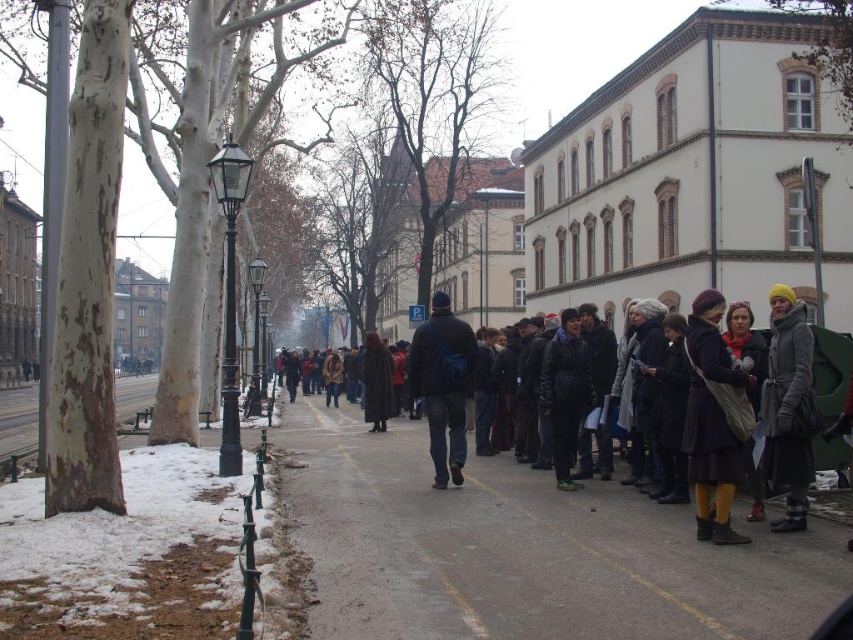
You are a photographer trying to capture a photo of the dark gray coat at center and the yellow knit hat at right. Since you want both subjects in the frame, can you tell me which direction you should position yourself relative to the group of people?

You should position yourself to the left side of the group of people because the dark gray coat at center is on the left side of the yellow knit hat at right, so standing to the left would allow you to capture both subjects in the frame.

You are a delivery person trying to reach the group of people waiting in the queue on the right side of the pathway. You are currently standing on the gray asphalt sidewalk at center. Which direction should you move to reach the dark gray coat at center first?

The gray asphalt sidewalk at center is in front of the dark gray coat at center, so to reach the dark gray coat at center first, you should move towards the direction of the dark gray coat at center by stepping off the gray asphalt sidewalk at center towards the group on the right side of the pathway.